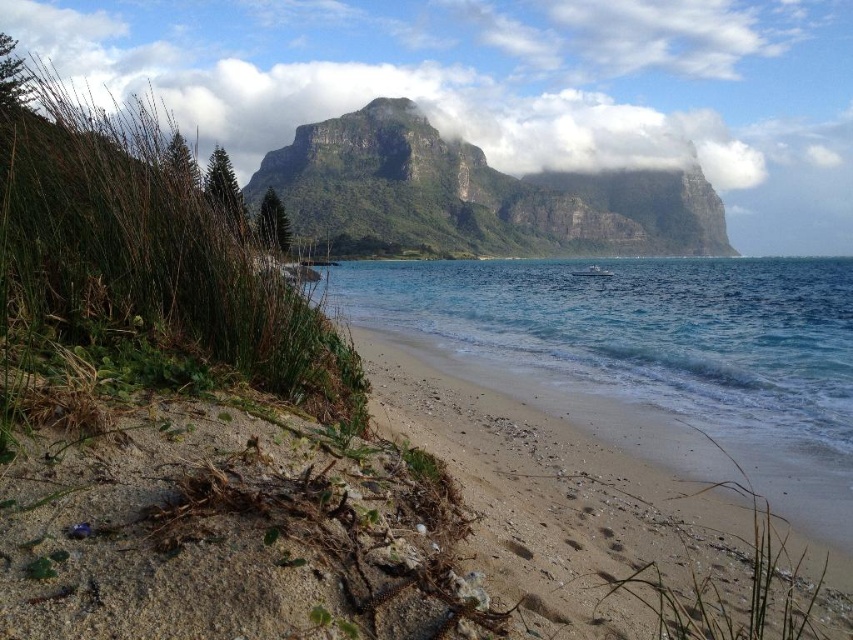
You are a photographer planning to capture the clear blue water at center and the rugged stone mountain at center in a single frame. Based on their widths, which object should you position closer to the center of your camera viewfinder to ensure both are adequately framed?

The clear blue water at center has a smaller width compared to the rugged stone mountain at center. To ensure both are adequately framed, position the clear blue water at center closer to the center of your camera viewfinder since it is narrower and requires less space, allowing the wider rugged stone mountain at center to be accommodated on either side.

You are standing at the point marked as point (584, 508) on a coastal landscape image. What is the terrain like at that specific location?

Answer: The terrain at point (584, 508) is a light brown sandy beach at center.

You are standing on the light brown sandy beach at center and looking towards the rugged stone mountain at center. Which object takes up more area in the scene?

The rugged stone mountain at center occupies more space than the light brown sandy beach at center in the scene.